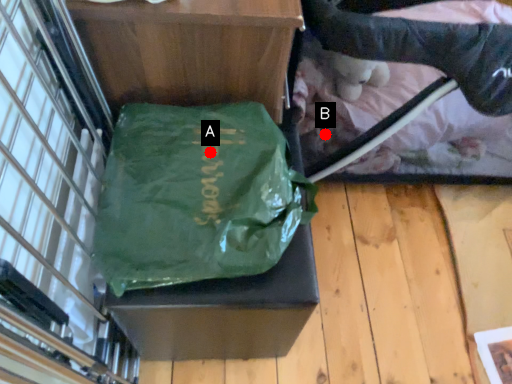
Question: Two points are circled on the image, labeled by A and B beside each circle. Which point is closer to the camera?

Choices:
 (A) A is closer
 (B) B is closer

Answer: (A)